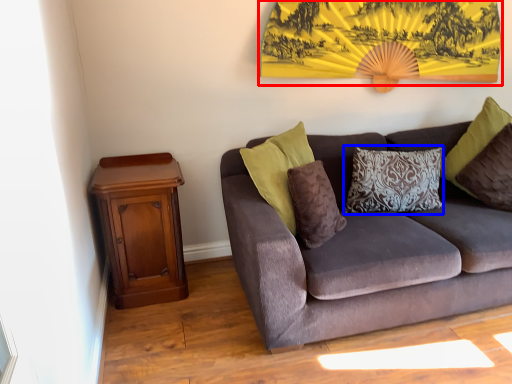
Question: Which object appears closest to the camera in this image, mountain view (highlighted by a red box) or pillow (highlighted by a blue box)?

Choices:
 (A) mountain view
 (B) pillow

Answer: (A)